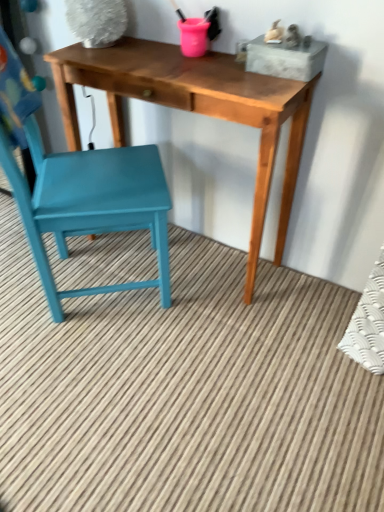
In order to click on wooden table at center in this screenshot , I will do `click(195, 109)`.

This screenshot has height=512, width=384. What do you see at coordinates (195, 109) in the screenshot? I see `wooden table at center` at bounding box center [195, 109].

What is the approximate height of teal painted wood chair at left?

teal painted wood chair at left is 37.88 inches in height.

What do you see at coordinates (79, 188) in the screenshot?
I see `teal painted wood chair at left` at bounding box center [79, 188].

The height and width of the screenshot is (512, 384). I want to click on teal painted wood chair at left, so pyautogui.click(x=79, y=188).

Where is `wooden table at center`? wooden table at center is located at coordinates 195,109.

Would you say wooden table at center is to the left or to the right of teal painted wood chair at left in the picture?

In the image, wooden table at center appears on the right side of teal painted wood chair at left.

From the picture: Which object is closer to the camera taking this photo, wooden table at center or teal painted wood chair at left?

teal painted wood chair at left is in front.

Which is farther, [200,94] or [107,219]?

Positioned behind is point [107,219].

From the image's perspective, relative to teal painted wood chair at left, is wooden table at center above or below?

Based on their image positions, wooden table at center is located above teal painted wood chair at left.

From a real-world perspective, which object stands above the other?

In real-world perspective, teal painted wood chair at left is above.

Consider the image. Which of these two, wooden table at center or teal painted wood chair at left, is wider?

Wider between the two is teal painted wood chair at left.

Considering the sizes of wooden table at center and teal painted wood chair at left in the image, is wooden table at center taller or shorter than teal painted wood chair at left?

In the image, wooden table at center appears to be shorter than teal painted wood chair at left.

Which of these two, wooden table at center or teal painted wood chair at left, is smaller?

With smaller size is wooden table at center.

Consider the image. Is teal painted wood chair at left inside wooden table at center?

No, teal painted wood chair at left is not surrounded by wooden table at center.

Is wooden table at center directly adjacent to teal painted wood chair at left?

There is a gap between wooden table at center and teal painted wood chair at left.

Is wooden table at center aimed at teal painted wood chair at left?

Yes, wooden table at center faces towards teal painted wood chair at left.

What are the coordinates of `table beneath the teal painted wood chair at left (from a real-world perspective)` in the screenshot? It's located at (195, 109).

In the scene shown: Can you confirm if teal painted wood chair at left is positioned to the right of wooden table at center?

No.

Between teal painted wood chair at left and wooden table at center, which one is positioned behind?

wooden table at center.

Which is more distant, (60, 162) or (286, 192)?

The point (286, 192) is behind.

From the image's perspective, which is above, teal painted wood chair at left or wooden table at center?

wooden table at center appears higher in the image.

From a real-world perspective, does teal painted wood chair at left stand above wooden table at center?

Yes, from a real-world perspective, teal painted wood chair at left is above wooden table at center.

Does teal painted wood chair at left have a greater width compared to wooden table at center?

Correct, the width of teal painted wood chair at left exceeds that of wooden table at center.

Is teal painted wood chair at left taller or shorter than wooden table at center?

Considering their sizes, teal painted wood chair at left has more height than wooden table at center.

Looking at the image, does teal painted wood chair at left seem bigger or smaller compared to wooden table at center?

In the image, teal painted wood chair at left appears to be larger than wooden table at center.

Is teal painted wood chair at left spatially inside wooden table at center, or outside of it?

teal painted wood chair at left is located beyond the bounds of wooden table at center.

Is the surface of teal painted wood chair at left in direct contact with wooden table at center?

No, teal painted wood chair at left is not making contact with wooden table at center.

Is teal painted wood chair at left facing away from wooden table at center?

No, teal painted wood chair at left is not facing away from wooden table at center.

Locate an element on the screen. Image resolution: width=384 pixels, height=512 pixels. chair below the wooden table at center (from the image's perspective) is located at coordinates (79, 188).

Where is `table on the right of teal painted wood chair at left`? The width and height of the screenshot is (384, 512). table on the right of teal painted wood chair at left is located at coordinates (195, 109).

Where is `chair lying below the wooden table at center (from the image's perspective)`? This screenshot has height=512, width=384. chair lying below the wooden table at center (from the image's perspective) is located at coordinates (79, 188).